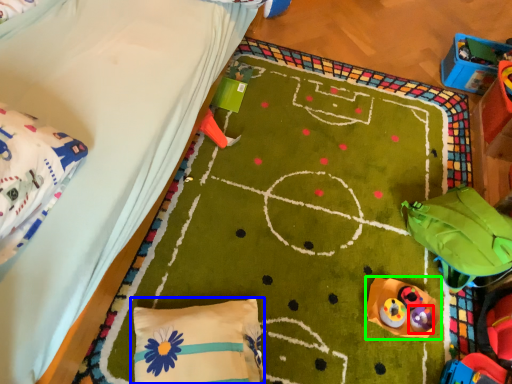
Question: Considering the real-world distances, which object is closest to toy (highlighted by a red box)? pillow (highlighted by a blue box) or toy (highlighted by a green box).

Choices:
 (A) pillow
 (B) toy

Answer: (B)